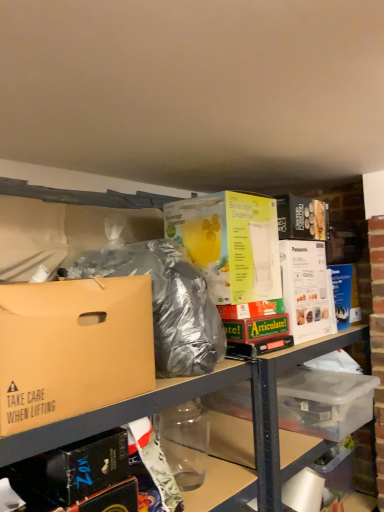
Identify the location of yellow cardboard beverage dispenser at center, the 2th box positioned from the left. (230, 243).

Locate an element on the screen. The height and width of the screenshot is (512, 384). shiny metallic bag at center is located at coordinates (165, 303).

You are a GUI agent. You are given a task and a screenshot of the screen. Output one action in this format:
    pyautogui.click(x=<x>, y=<y>)
    Task: Click on the clear plastic bottle at lower center
    
    Given the screenshot: What is the action you would take?
    pyautogui.click(x=142, y=415)

Locate an element on the screen. This screenshot has height=512, width=384. yellow cardboard beverage dispenser at center, the 2th box positioned from the left is located at coordinates (230, 243).

Between clear plastic container at center and clear plastic bottle at lower center, which one appears on the right side from the viewer's perspective?

From the viewer's perspective, clear plastic container at center appears more on the right side.

Is clear plastic container at center wider than clear plastic bottle at lower center?

Yes, clear plastic container at center is wider than clear plastic bottle at lower center.

Is clear plastic container at center turned away from clear plastic bottle at lower center?

No, clear plastic container at center's orientation is not away from clear plastic bottle at lower center.

From a real-world perspective, is clear plastic container at center physically located above or below clear plastic bottle at lower center?

Clearly, from a real-world perspective, clear plastic container at center is below clear plastic bottle at lower center.

Where is `the 2nd box directly above the clear plastic container at center (from a real-world perspective)`? the 2nd box directly above the clear plastic container at center (from a real-world perspective) is located at coordinates coord(230,243).

Is yellow cardboard beverage dispenser at center, the 1th box when ordered from back to front, taller than clear plastic container at center?

No, yellow cardboard beverage dispenser at center, the 1th box when ordered from back to front, is not taller than clear plastic container at center.

Looking at this image, from a real-world perspective, is yellow cardboard beverage dispenser at center, which is the first box from right to left, positioned over clear plastic container at center based on gravity?

Yes, from a real-world perspective, yellow cardboard beverage dispenser at center, which is the first box from right to left, is on top of clear plastic container at center.

Between yellow cardboard beverage dispenser at center, the 2th box from the front, and clear plastic container at center, which one has larger width?

clear plastic container at center is wider.

Image resolution: width=384 pixels, height=512 pixels. Identify the location of shelf on the left of yellow cardboard beverage dispenser at center, which is the first box from right to left. (142, 415).

From a real-world perspective, is clear plastic bottle at lower center positioned above or below yellow cardboard beverage dispenser at center, the 1th box when ordered from back to front?

Clearly, from a real-world perspective, clear plastic bottle at lower center is below yellow cardboard beverage dispenser at center, the 1th box when ordered from back to front.

Is yellow cardboard beverage dispenser at center, which is the first box from right to left, at the back of clear plastic bottle at lower center?

clear plastic bottle at lower center does not have its back to yellow cardboard beverage dispenser at center, which is the first box from right to left.

Visually, is clear plastic storage box at lower right positioned to the left or to the right of clear plastic bottle at lower center?

From the image, it's evident that clear plastic storage box at lower right is to the right of clear plastic bottle at lower center.

Is clear plastic storage box at lower right far from clear plastic bottle at lower center?

No, clear plastic storage box at lower right is not far away from clear plastic bottle at lower center.

At what (x,y) coordinates should I click in order to perform the action: click on shelf that is above the clear plastic storage box at lower right (from the image's perspective). Please return your answer as a coordinate pair (x, y). The width and height of the screenshot is (384, 512). Looking at the image, I should click on (142, 415).

How much distance is there between clear plastic storage box at lower right and clear plastic bottle at lower center?

A distance of 20.66 inches exists between clear plastic storage box at lower right and clear plastic bottle at lower center.

Is point (177, 300) closer to camera compared to point (336, 375)?

That is True.

In the image, is shiny metallic bag at center on the left side or the right side of clear plastic storage box at lower right?

From the image, it's evident that shiny metallic bag at center is to the left of clear plastic storage box at lower right.

Would you say shiny metallic bag at center is outside clear plastic storage box at lower right?

Yes, shiny metallic bag at center is not within clear plastic storage box at lower right.

Is shiny metallic bag at center oriented away from clear plastic storage box at lower right?

No, shiny metallic bag at center is not facing away from clear plastic storage box at lower right.

Which point is more distant from viewer, (302, 424) or (36, 367)?

The point (302, 424) is more distant.

Is clear plastic storage box at lower right oriented away from brown cardboard box at left, which appears as the 1th box when viewed from the left?

No, clear plastic storage box at lower right's orientation is not away from brown cardboard box at left, which appears as the 1th box when viewed from the left.

Find the location of `box that is the 2nd one when counting leftward from the clear plastic storage box at lower right`. box that is the 2nd one when counting leftward from the clear plastic storage box at lower right is located at coordinates (72, 348).

From a real-world perspective, between clear plastic storage box at lower right and brown cardboard box at left, the first box from the front, who is vertically lower?

From a 3D spatial view, clear plastic storage box at lower right is below.

Does clear plastic container at center turn towards shiny metallic bag at center?

No.

Considering their positions, is clear plastic container at center located in front of or behind shiny metallic bag at center?

Visually, clear plastic container at center is located behind shiny metallic bag at center.

How different are the orientations of clear plastic container at center and shiny metallic bag at center in degrees?

The angular difference between clear plastic container at center and shiny metallic bag at center is 0.878 degrees.

Does clear plastic container at center appear on the left side of shiny metallic bag at center?

No.

Locate an element on the screen. This screenshot has width=384, height=512. table that is behind the clear plastic bottle at lower center is located at coordinates (x=276, y=399).

The image size is (384, 512). Find the location of `table below the yellow cardboard beverage dispenser at center, which is the first box from right to left (from the image's perspective)`. table below the yellow cardboard beverage dispenser at center, which is the first box from right to left (from the image's perspective) is located at coordinates (276, 399).

Based on their spatial positions, is clear plastic storage box at lower right or yellow cardboard beverage dispenser at center, the 2th box from the front, further from clear plastic container at center?

yellow cardboard beverage dispenser at center, the 2th box from the front, is further to clear plastic container at center.

When comparing their distances from clear plastic bottle at lower center, does clear plastic storage box at lower right or brown cardboard box at left, the first box from the front, seem further?

The object further to clear plastic bottle at lower center is clear plastic storage box at lower right.

Consider the image. Looking at the image, which one is located closer to brown cardboard box at left, the first box from the front, clear plastic storage box at lower right or clear plastic bottle at lower center?

clear plastic bottle at lower center is closer to brown cardboard box at left, the first box from the front.

From the image, which object appears to be nearer to clear plastic storage box at lower right, yellow cardboard beverage dispenser at center, the 1th box when ordered from back to front, or brown cardboard box at left, which appears as the 1th box when viewed from the left?

Among the two, yellow cardboard beverage dispenser at center, the 1th box when ordered from back to front, is located nearer to clear plastic storage box at lower right.

From the picture: Which object lies nearer to the anchor point clear plastic bottle at lower center, yellow cardboard beverage dispenser at center, the 2th box from the front, or brown cardboard box at left, the first box from the front?

brown cardboard box at left, the first box from the front, is positioned closer to the anchor clear plastic bottle at lower center.

Looking at this image, when comparing their distances from clear plastic storage box at lower right, does shiny metallic bag at center or brown cardboard box at left, the first box from the front, seem further?

brown cardboard box at left, the first box from the front.

Looking at the image, which one is located closer to shiny metallic bag at center, brown cardboard box at left, the second box viewed from the back, or clear plastic bottle at lower center?

Based on the image, brown cardboard box at left, the second box viewed from the back, appears to be nearer to shiny metallic bag at center.

Looking at the image, which one is located closer to shiny metallic bag at center, clear plastic container at center or clear plastic storage box at lower right?

clear plastic container at center is positioned closer to the anchor shiny metallic bag at center.

I want to click on box between shiny metallic bag at center and clear plastic bottle at lower center vertically, so click(x=72, y=348).

What are the coordinates of `table between clear plastic bottle at lower center and clear plastic storage box at lower right` in the screenshot? It's located at (276, 399).

The width and height of the screenshot is (384, 512). I want to click on shelf between brown cardboard box at left, the first box from the front, and clear plastic storage box at lower right, so click(142, 415).

You are a GUI agent. You are given a task and a screenshot of the screen. Output one action in this format:
    pyautogui.click(x=<x>, y=<y>)
    Task: Click on the storage box between shiny metallic bag at center and clear plastic container at center in the up-down direction
    The image size is (384, 512).
    Given the screenshot: What is the action you would take?
    pyautogui.click(x=324, y=402)